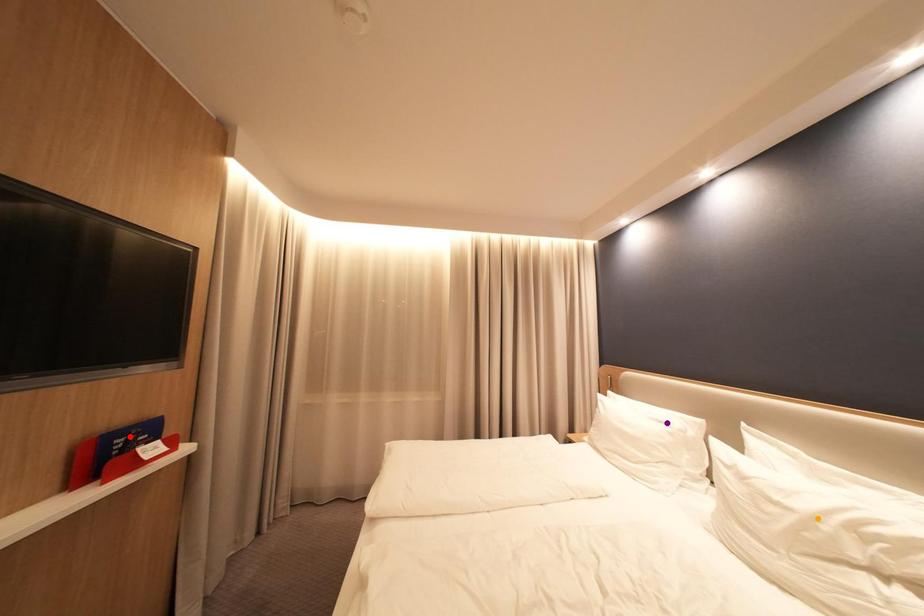
Order these from nearest to farthest:
- red point
- orange point
- purple point

orange point < red point < purple point